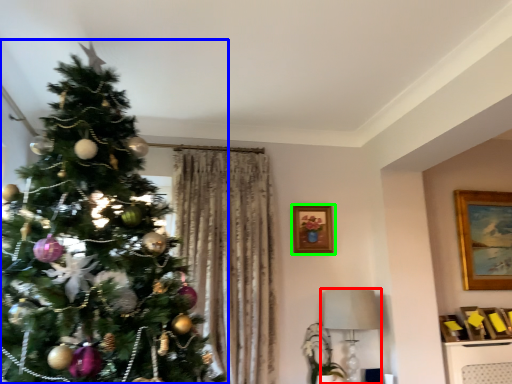
Question: Which is nearer to the lamp (highlighted by a red box)? christmas tree (highlighted by a blue box) or picture frame (highlighted by a green box).

Choices:
 (A) christmas tree
 (B) picture frame

Answer: (B)